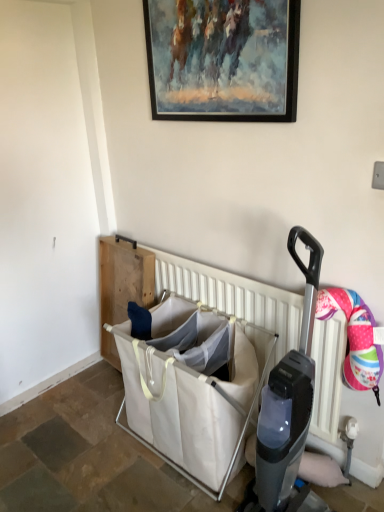
Question: Could you tell me if white canvas laundry basket at center is facing painted wood picture frame at upper center?

Choices:
 (A) yes
 (B) no

Answer: (B)

Question: Are white canvas laundry basket at center and painted wood picture frame at upper center beside each other?

Choices:
 (A) no
 (B) yes

Answer: (A)

Question: Can you confirm if white canvas laundry basket at center is taller than painted wood picture frame at upper center?

Choices:
 (A) yes
 (B) no

Answer: (A)

Question: Is white canvas laundry basket at center behind painted wood picture frame at upper center?

Choices:
 (A) yes
 (B) no

Answer: (A)

Question: Is white canvas laundry basket at center positioned far away from painted wood picture frame at upper center?

Choices:
 (A) no
 (B) yes

Answer: (B)

Question: In terms of height, does white plastic radiator at center look taller or shorter compared to painted wood picture frame at upper center?

Choices:
 (A) tall
 (B) short

Answer: (A)

Question: Considering the positions of white plastic radiator at center and painted wood picture frame at upper center in the image, is white plastic radiator at center bigger or smaller than painted wood picture frame at upper center?

Choices:
 (A) big
 (B) small

Answer: (A)

Question: Is point (289, 320) closer or farther from the camera than point (263, 94)?

Choices:
 (A) farther
 (B) closer

Answer: (A)

Question: From a real-world perspective, is white plastic radiator at center above or below painted wood picture frame at upper center?

Choices:
 (A) below
 (B) above

Answer: (A)

Question: Is point (150, 364) positioned closer to the camera than point (218, 24)?

Choices:
 (A) closer
 (B) farther

Answer: (B)

Question: From a real-world perspective, is white canvas laundry basket at center above or below painted wood picture frame at upper center?

Choices:
 (A) above
 (B) below

Answer: (B)

Question: In terms of width, does white canvas laundry basket at center look wider or thinner when compared to painted wood picture frame at upper center?

Choices:
 (A) wide
 (B) thin

Answer: (A)

Question: From the image's perspective, is white canvas laundry basket at center positioned above or below painted wood picture frame at upper center?

Choices:
 (A) below
 (B) above

Answer: (A)

Question: Looking at the image, does white canvas laundry basket at center seem bigger or smaller compared to white plastic radiator at center?

Choices:
 (A) small
 (B) big

Answer: (B)

Question: From the image's perspective, is white canvas laundry basket at center positioned above or below white plastic radiator at center?

Choices:
 (A) below
 (B) above

Answer: (A)